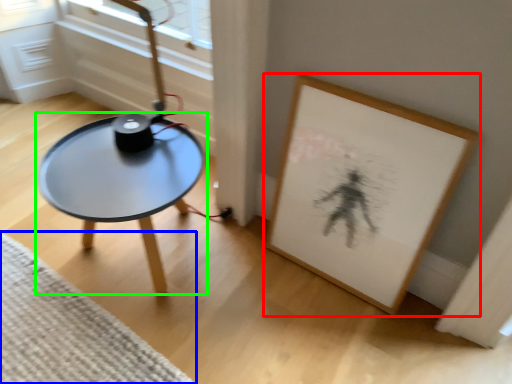
Question: Based on their relative distances, which object is nearer to picture frame (highlighted by a red box)? Choose from mat (highlighted by a blue box) and coffee table (highlighted by a green box).

Choices:
 (A) mat
 (B) coffee table

Answer: (B)